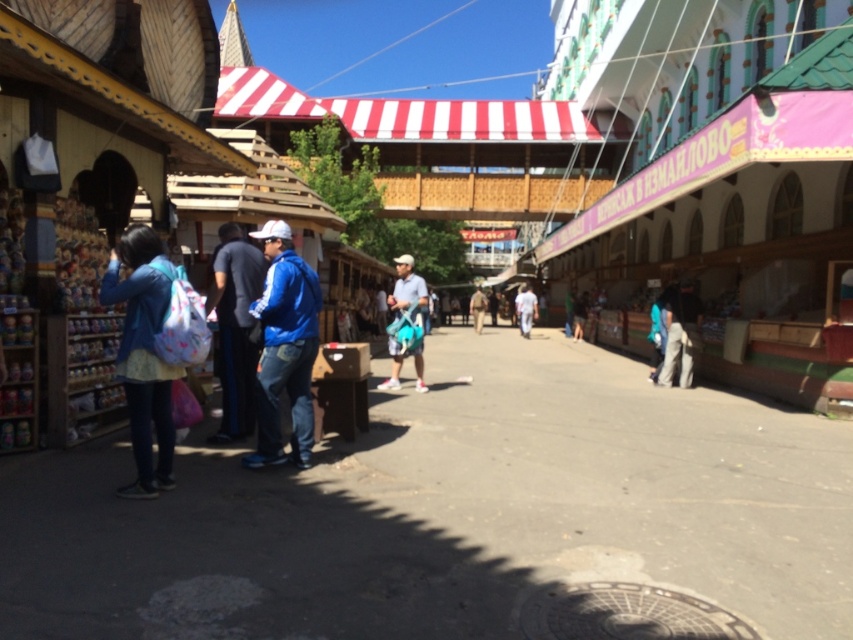
Question: From the image, what is the correct spatial relationship of blue denim jacket at left in relation to light gray fabric jacket at center?

Choices:
 (A) left
 (B) right

Answer: (A)

Question: Is blue fabric jacket at center to the right of white fabric shirt at center from the viewer's perspective?

Choices:
 (A) no
 (B) yes

Answer: (A)

Question: Among these objects, which one is farthest from the camera?

Choices:
 (A) light blue denim jacket at center
 (B) blue denim jacket at center
 (C) light gray fabric jacket at center
 (D) white fabric shirt at center

Answer: (A)

Question: Which point is farther to the camera?

Choices:
 (A) (149, 483)
 (B) (584, 301)

Answer: (B)

Question: Is blue matte jacket at center positioned behind blue denim jacket at center?

Choices:
 (A) yes
 (B) no

Answer: (B)

Question: Based on their relative distances, which object is nearer to the blue fabric jacket at center?

Choices:
 (A) matte blue shorts at center
 (B) blue denim jacket at center
 (C) white fabric shirt at center
 (D) light gray fabric jacket at center

Answer: (A)